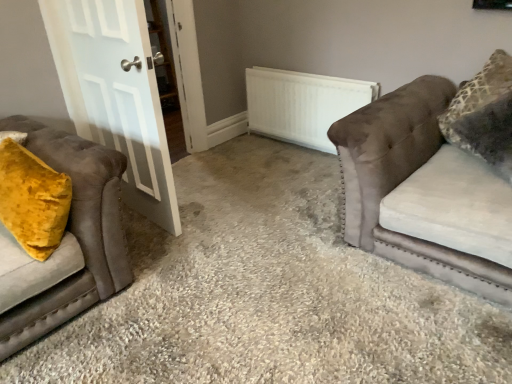
Describe the element at coordinates (302, 104) in the screenshot. I see `white matte radiator at center` at that location.

Describe the element at coordinates (32, 200) in the screenshot. The width and height of the screenshot is (512, 384). I see `velvet yellow pillow at left` at that location.

The width and height of the screenshot is (512, 384). In order to click on white glossy door at left in this screenshot , I will do `click(116, 94)`.

The image size is (512, 384). Describe the element at coordinates (116, 94) in the screenshot. I see `white glossy door at left` at that location.

Measure the distance between point (30, 315) and camera.

1.75 meters.

Identify the location of white matte radiator at center. This screenshot has width=512, height=384. (302, 104).

From a real-world perspective, is white glossy door at left on velvet brown couch at right, placed as the first studio couch when sorted from right to left?

Yes, from a real-world perspective, white glossy door at left is on top of velvet brown couch at right, placed as the first studio couch when sorted from right to left.

Considering the sizes of objects white glossy door at left and velvet brown couch at right, placed as the first studio couch when sorted from right to left, in the image provided, who is thinner, white glossy door at left or velvet brown couch at right, placed as the first studio couch when sorted from right to left,?

Thinner between the two is white glossy door at left.

From the image's perspective, which object appears higher, white glossy door at left or velvet brown couch at right, placed as the first studio couch when sorted from right to left?

white glossy door at left is shown above in the image.

From a real-world perspective, between velvet mustard pillow at left, marked as the 1th studio couch in a left-to-right arrangement, and white matte radiator at center, who is vertically higher?

velvet mustard pillow at left, marked as the 1th studio couch in a left-to-right arrangement, is physically above.

Is velvet mustard pillow at left, marked as the 1th studio couch in a left-to-right arrangement, spatially inside white matte radiator at center, or outside of it?

velvet mustard pillow at left, marked as the 1th studio couch in a left-to-right arrangement, is located beyond the bounds of white matte radiator at center.

Which of these two, velvet mustard pillow at left, the 2th studio couch from the right, or white matte radiator at center, is bigger?

velvet mustard pillow at left, the 2th studio couch from the right, is bigger.

Which is closer to the camera, [78,93] or [41,210]?

Point [78,93] is positioned farther from the camera compared to point [41,210].

Considering the sizes of objects white glossy door at left and velvet yellow pillow at left in the image provided, who is wider, white glossy door at left or velvet yellow pillow at left?

With larger width is velvet yellow pillow at left.

Would you say white glossy door at left is inside or outside velvet yellow pillow at left?

white glossy door at left exists outside the volume of velvet yellow pillow at left.

Considering the points (298, 88) and (403, 161), which point is behind, point (298, 88) or point (403, 161)?

Positioned behind is point (298, 88).

Is white matte radiator at center not close to velvet brown couch at right, positioned as the second studio couch in left-to-right order?

No, there isn't a large distance between white matte radiator at center and velvet brown couch at right, positioned as the second studio couch in left-to-right order.

Is white matte radiator at center taller or shorter than velvet brown couch at right, placed as the first studio couch when sorted from right to left?

Considering their sizes, white matte radiator at center has less height than velvet brown couch at right, placed as the first studio couch when sorted from right to left.

Is white matte radiator at center spatially inside velvet brown couch at right, placed as the first studio couch when sorted from right to left, or outside of it?

white matte radiator at center is not enclosed by velvet brown couch at right, placed as the first studio couch when sorted from right to left.

Is velvet mustard pillow at left, the 2th studio couch from the right, bigger than white glossy door at left?

Yes.

Is velvet mustard pillow at left, the 2th studio couch from the right, wider than white glossy door at left?

Yes, velvet mustard pillow at left, the 2th studio couch from the right, is wider than white glossy door at left.

From the image's perspective, which one is positioned lower, velvet mustard pillow at left, the 2th studio couch from the right, or white glossy door at left?

velvet mustard pillow at left, the 2th studio couch from the right, appears lower in the image.

Considering the positions of point (103, 298) and point (148, 122), is point (103, 298) closer or farther from the camera than point (148, 122)?

Point (103, 298) is positioned closer to the camera compared to point (148, 122).

Find the location of `throw pillow above the velvet brown couch at right, positioned as the second studio couch in left-to-right order (from a real-world perspective)`. throw pillow above the velvet brown couch at right, positioned as the second studio couch in left-to-right order (from a real-world perspective) is located at coordinates (32, 200).

Which of these two, velvet yellow pillow at left or velvet brown couch at right, placed as the first studio couch when sorted from right to left, is bigger?

Bigger between the two is velvet brown couch at right, placed as the first studio couch when sorted from right to left.

Does velvet yellow pillow at left have a lesser height compared to velvet brown couch at right, positioned as the second studio couch in left-to-right order?

No.

From a real-world perspective, is velvet yellow pillow at left below velvet brown couch at right, positioned as the second studio couch in left-to-right order?

No, from a real-world perspective, velvet yellow pillow at left is not below velvet brown couch at right, positioned as the second studio couch in left-to-right order.

Does velvet yellow pillow at left turn towards white matte radiator at center?

No, velvet yellow pillow at left does not turn towards white matte radiator at center.

From the image's perspective, which one is positioned higher, velvet yellow pillow at left or white matte radiator at center?

white matte radiator at center, from the image's perspective.

Looking at this image, how many degrees apart are the facing directions of velvet yellow pillow at left and white matte radiator at center?

The facing directions of velvet yellow pillow at left and white matte radiator at center are 32.3 degrees apart.

In the image, there is a white matte radiator at center. What are the coordinates of `throw pillow below it (from the image's perspective)` in the screenshot? It's located at (32, 200).

Identify the location of door that is on the left side of velvet brown couch at right, placed as the first studio couch when sorted from right to left. The width and height of the screenshot is (512, 384). (116, 94).

The height and width of the screenshot is (384, 512). Identify the location of radiator above the velvet mustard pillow at left, marked as the 1th studio couch in a left-to-right arrangement (from the image's perspective). (302, 104).

Which object lies nearer to the anchor point velvet brown couch at right, positioned as the second studio couch in left-to-right order, white matte radiator at center or velvet yellow pillow at left?

The object closer to velvet brown couch at right, positioned as the second studio couch in left-to-right order, is white matte radiator at center.

When comparing their distances from velvet mustard pillow at left, the 2th studio couch from the right, does velvet yellow pillow at left or white glossy door at left seem further?

Based on the image, white glossy door at left appears to be further to velvet mustard pillow at left, the 2th studio couch from the right.

Based on their spatial positions, is white glossy door at left or velvet brown couch at right, positioned as the second studio couch in left-to-right order, closer to white matte radiator at center?

The object closer to white matte radiator at center is velvet brown couch at right, positioned as the second studio couch in left-to-right order.

Which object lies nearer to the anchor point white glossy door at left, velvet brown couch at right, positioned as the second studio couch in left-to-right order, or velvet yellow pillow at left?

The object closer to white glossy door at left is velvet yellow pillow at left.

When comparing their distances from velvet mustard pillow at left, marked as the 1th studio couch in a left-to-right arrangement, does velvet brown couch at right, placed as the first studio couch when sorted from right to left, or velvet yellow pillow at left seem closer?

velvet yellow pillow at left.

Which object lies further to the anchor point white matte radiator at center, velvet yellow pillow at left or velvet mustard pillow at left, marked as the 1th studio couch in a left-to-right arrangement?

velvet yellow pillow at left is positioned further to the anchor white matte radiator at center.

Consider the image. Looking at the image, which one is located further to velvet mustard pillow at left, marked as the 1th studio couch in a left-to-right arrangement, white matte radiator at center or velvet brown couch at right, placed as the first studio couch when sorted from right to left?

white matte radiator at center lies further to velvet mustard pillow at left, marked as the 1th studio couch in a left-to-right arrangement, than the other object.

Looking at the image, which one is located closer to velvet mustard pillow at left, the 2th studio couch from the right, velvet brown couch at right, positioned as the second studio couch in left-to-right order, or white matte radiator at center?

velvet brown couch at right, positioned as the second studio couch in left-to-right order.

You are a GUI agent. You are given a task and a screenshot of the screen. Output one action in this format:
    pyautogui.click(x=<x>, y=<y>)
    Task: Click on the studio couch located between velvet yellow pillow at left and velvet brown couch at right, positioned as the second studio couch in left-to-right order, in the left-right direction
    This screenshot has height=384, width=512.
    Given the screenshot: What is the action you would take?
    pyautogui.click(x=74, y=234)

You are a GUI agent. You are given a task and a screenshot of the screen. Output one action in this format:
    pyautogui.click(x=<x>, y=<y>)
    Task: Click on the door between velvet yellow pillow at left and velvet brown couch at right, placed as the first studio couch when sorted from right to left
    The height and width of the screenshot is (384, 512).
    Given the screenshot: What is the action you would take?
    tap(116, 94)

Locate an element on the screen. radiator between velvet yellow pillow at left and velvet brown couch at right, positioned as the second studio couch in left-to-right order, from left to right is located at coordinates (302, 104).

Image resolution: width=512 pixels, height=384 pixels. Identify the location of radiator located between white glossy door at left and velvet brown couch at right, placed as the first studio couch when sorted from right to left, in the left-right direction. (302, 104).